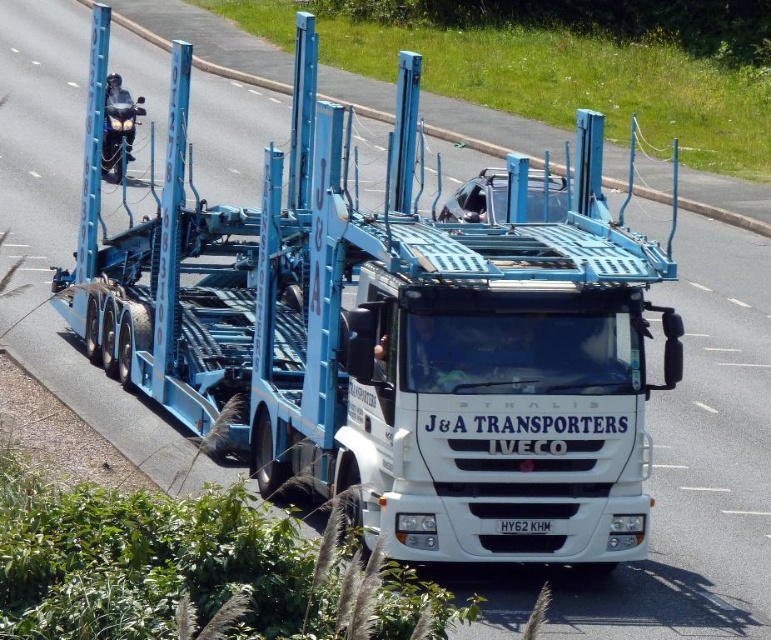
Question: Is white matte trailer truck at center positioned at the back of shiny chrome motorcycle at left?

Choices:
 (A) yes
 (B) no

Answer: (B)

Question: Can you confirm if white matte trailer truck at center is bigger than shiny chrome motorcycle at left?

Choices:
 (A) no
 (B) yes

Answer: (B)

Question: Which point is closer to the camera?

Choices:
 (A) (115, 147)
 (B) (544, 291)

Answer: (B)

Question: Observing the image, what is the correct spatial positioning of white matte trailer truck at center in reference to shiny chrome motorcycle at left?

Choices:
 (A) right
 (B) left

Answer: (A)